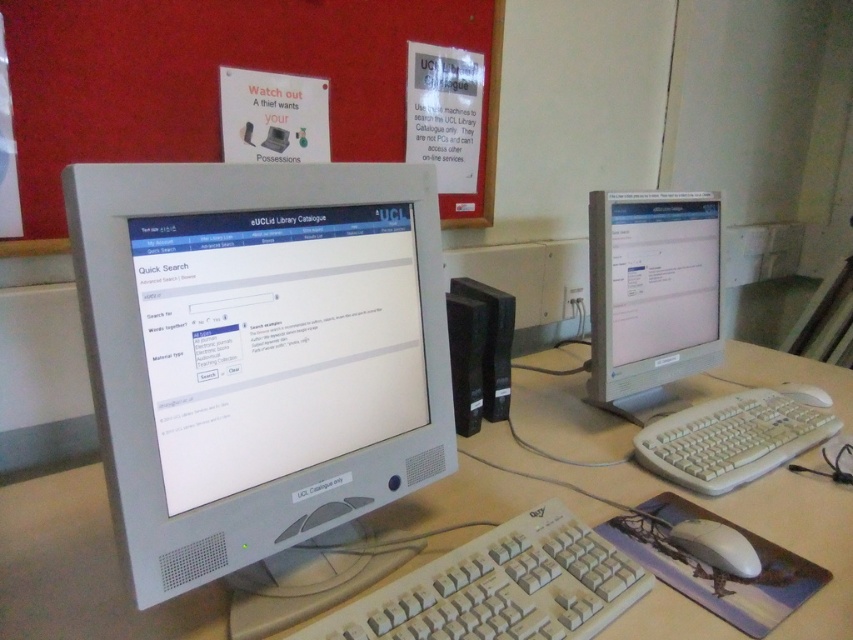
You are a librarian trying to access the eUCLid Library Catalogue on the monitor on the left. Where is the beige plastic keyboard at lower center located in relation to your current position?

The beige plastic keyboard at lower center is located at point (502,588).